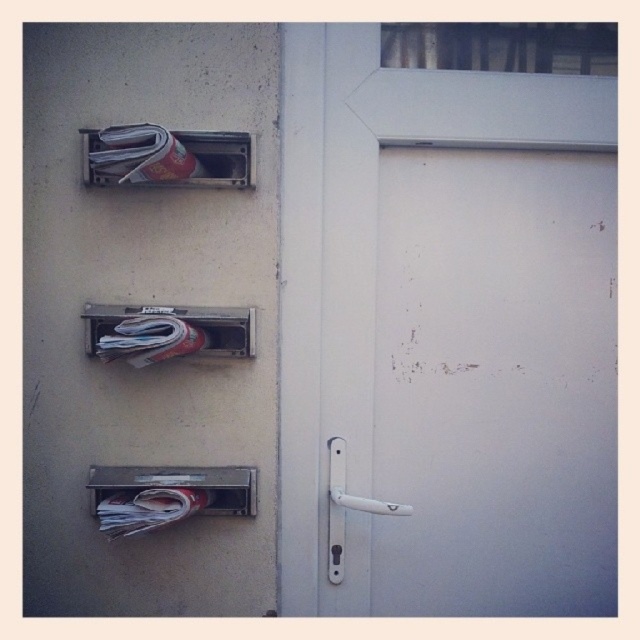
You are standing 1.5 meters away from the wall with the mail slots. There is a point at coordinates point (100, 147) that you want to reach. Can you touch it without moving closer?

The distance of point (100, 147) from viewer is 1.56 meters, so you are currently 1.5 meters away from the wall. Since the point is 0.06 meters further away than your current position, you cannot touch it without moving closer.

You are trying to reach the white plastic door handle at center from the metallic newspaper at upper left. Which object is closer to your hand when you are standing in front of the wall?

The metallic newspaper at upper left is closer to your hand than the white plastic door handle at center because it is not as tall as the handle.